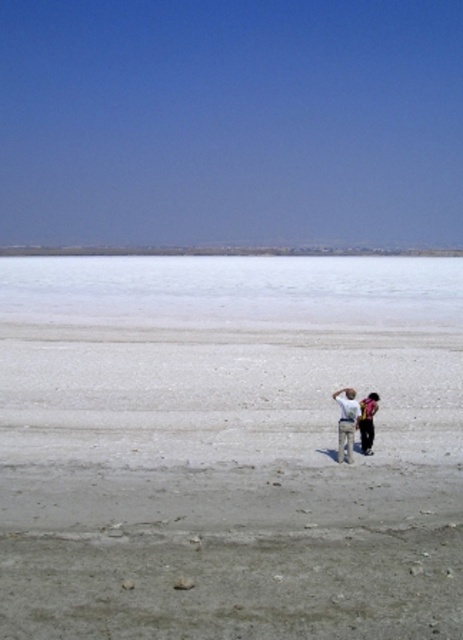
Question: Which of the following is the farthest from the observer?

Choices:
 (A) white smooth salt lake at center
 (B) dark brown leather jacket at lower right
 (C) gray sandy dirt field at center

Answer: (A)

Question: Does gray sandy dirt field at center have a greater width compared to white smooth salt lake at center?

Choices:
 (A) no
 (B) yes

Answer: (A)

Question: Which object is farther from the camera taking this photo?

Choices:
 (A) matte khaki pants at center
 (B) white smooth salt lake at center
 (C) dark brown leather jacket at lower right
 (D) gray sandy dirt field at center

Answer: (B)

Question: Which object is farther from the camera taking this photo?

Choices:
 (A) gray sandy dirt field at center
 (B) matte khaki pants at center

Answer: (B)

Question: Is gray sandy dirt field at center wider than dark brown leather jacket at lower right?

Choices:
 (A) yes
 (B) no

Answer: (A)

Question: Can you confirm if matte khaki pants at center is positioned above dark brown leather jacket at lower right?

Choices:
 (A) yes
 (B) no

Answer: (A)